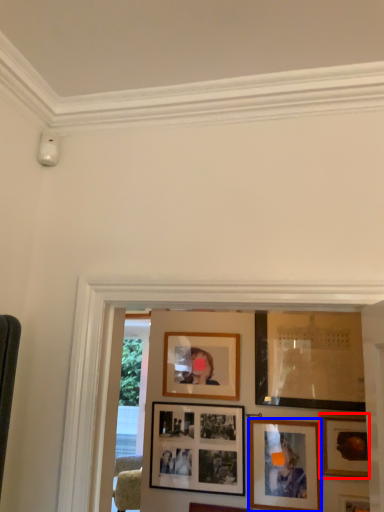
Question: Which point is further to the camera, picture frame (highlighted by a red box) or picture frame (highlighted by a blue box)?

Choices:
 (A) picture frame
 (B) picture frame

Answer: (B)